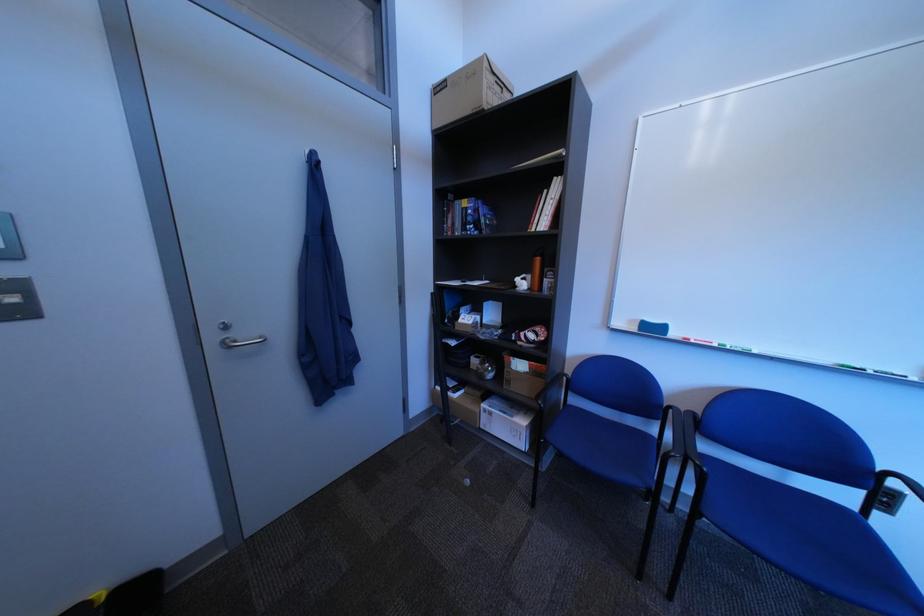
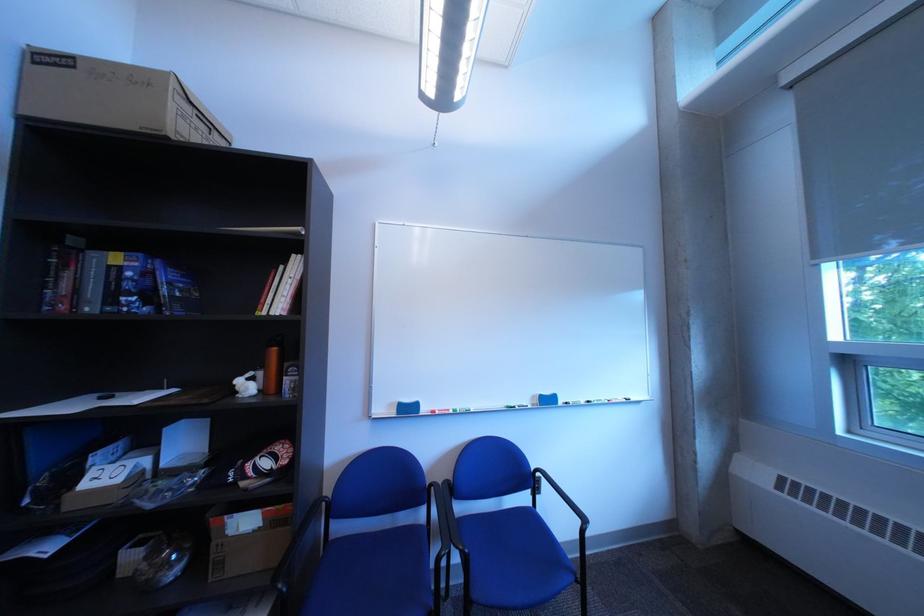
Find the pixel in the second image that matches point 525,383 in the first image.

(237, 565)